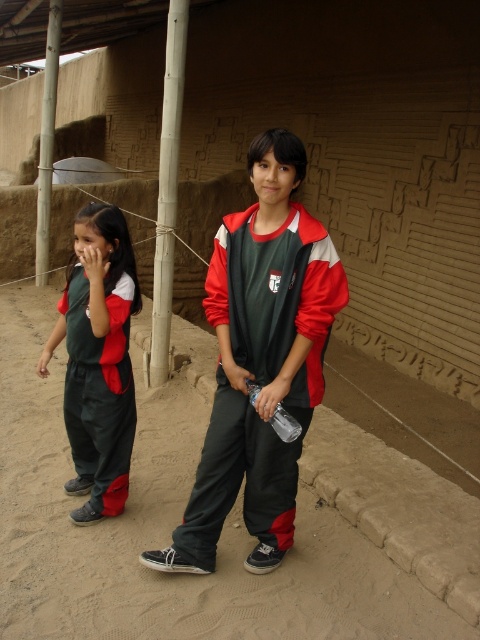
You are a photographer trying to capture a closeup of the matte green tracksuit at center and the clear plastic bottle at center. Given that your camera has a maximum focus range of 30 centimeters, will you be able to focus on both objects simultaneously?

The matte green tracksuit at center and clear plastic bottle at center are 33.85 centimeters apart from each other. Since the distance between them exceeds the camera maximum focus range of 30 centimeters, you cannot focus on both objects simultaneously.

You are a photographer trying to capture a photo of the dark gray sand at center and the matte green uniform at left. Which object should you focus on first to ensure it appears sharp in the photo?

The dark gray sand at center is closer to the viewer than the matte green uniform at left, so you should focus on the dark gray sand at center first to ensure it appears sharp.